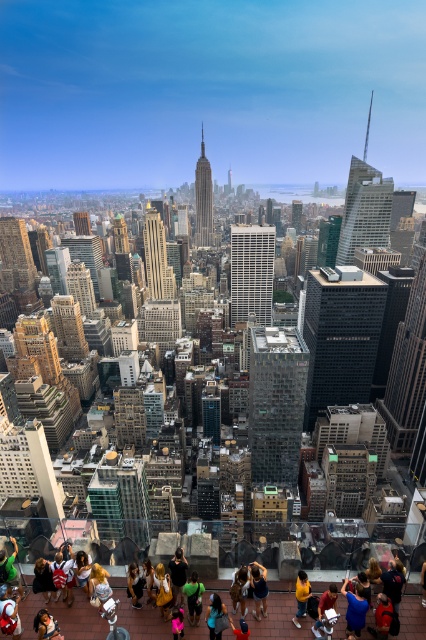
Between green fabric shirt at center and matte black hair at lower left, which one is positioned lower?

matte black hair at lower left

Is point (193, 588) positioned in front of point (42, 636)?

No, (193, 588) is further to viewer.

Which is in front, point (195, 586) or point (52, 630)?

Positioned in front is point (52, 630).

Locate an element on the screen. green fabric shirt at center is located at coordinates (193, 596).

Which is more to the right, yellow matte shirt at center or black leather jacket at lower center?

Positioned to the right is yellow matte shirt at center.

Can you confirm if yellow matte shirt at center is positioned below black leather jacket at lower center?

Yes.

Locate an element on the screen. This screenshot has width=426, height=640. yellow matte shirt at center is located at coordinates (301, 595).

Is blue denim jeans at lower right shorter than blue denim jeans at lower center?

In fact, blue denim jeans at lower right may be taller than blue denim jeans at lower center.

Does point (351, 612) come closer to viewer compared to point (241, 621)?

No, (351, 612) is further to viewer.

Where is `blue denim jeans at lower right`? blue denim jeans at lower right is located at coordinates (354, 611).